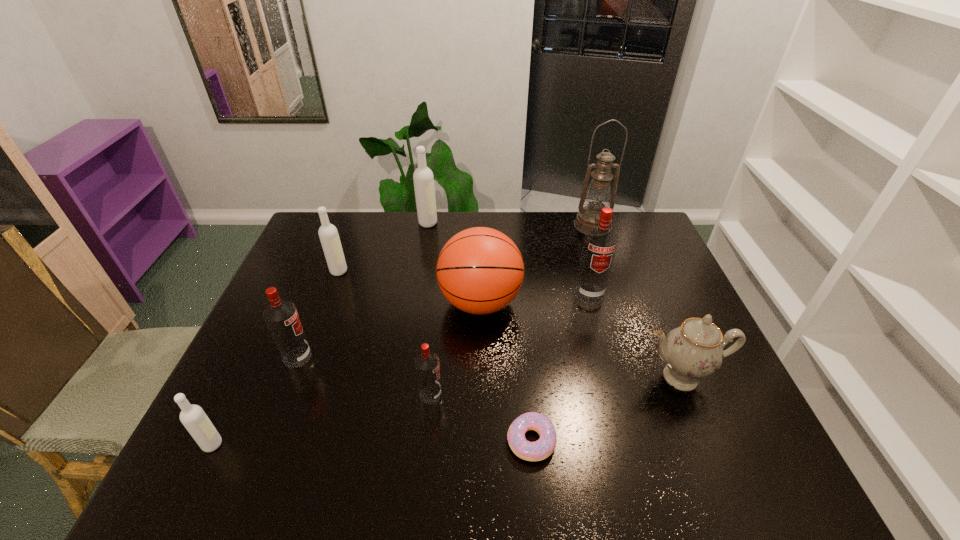
You are a GUI agent. You are given a task and a screenshot of the screen. Output one action in this format:
    pyautogui.click(x=<x>, y=<y>)
    Task: Click on the chinaware
    
    Given the screenshot: What is the action you would take?
    pyautogui.click(x=693, y=351)

I want to click on the fifth farthest vodka, so click(x=427, y=367).

This screenshot has height=540, width=960. Identify the location of the smallest red vodka. (427, 367).

Find the location of a particular element. the smallest white vodka is located at coordinates (194, 419).

Find the location of a particular element. The height and width of the screenshot is (540, 960). the leftmost object is located at coordinates (194, 419).

Where is `the shortest object`? This screenshot has width=960, height=540. the shortest object is located at coordinates (539, 450).

Find the location of a particular element. pink doughnut is located at coordinates (539, 450).

I want to click on vacant space positioned on the front of the tallest object, so click(608, 270).

Find the location of a particular element. The height and width of the screenshot is (540, 960). vacant space located on the front of the fourth object from left to right is located at coordinates (420, 267).

You are a GUI agent. You are given a task and a screenshot of the screen. Output one action in this format:
    pyautogui.click(x=<x>, y=<y>)
    Task: Click on the free space located 0.120m on the front label of the rightmost red vodka
    
    Given the screenshot: What is the action you would take?
    pyautogui.click(x=601, y=334)